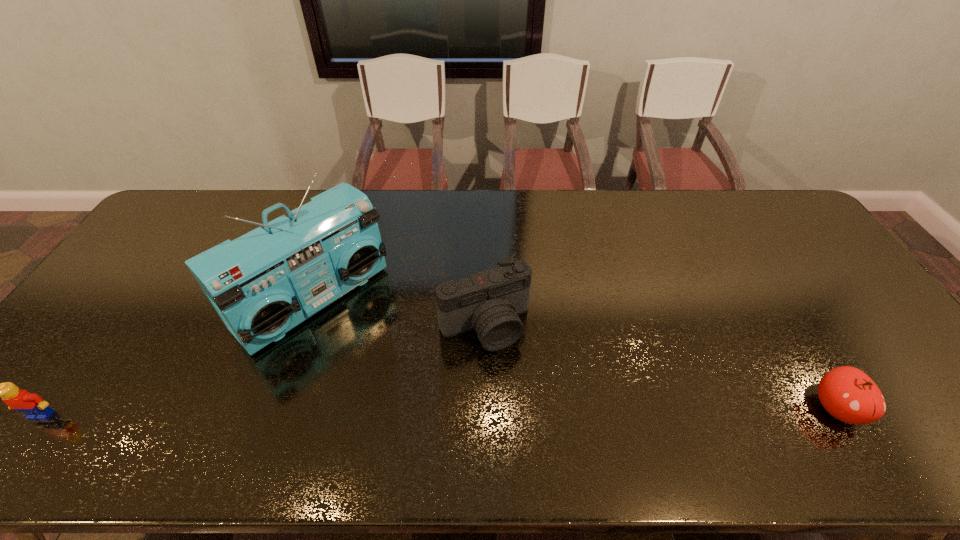
This screenshot has width=960, height=540. In the image, there is a desktop. In order to click on vacant area at the right edge in this screenshot , I will do `click(790, 240)`.

In the image, there is a desktop. At what (x,y) coordinates should I click in order to perform the action: click on vacant space at the far right corner. Please return your answer as a coordinate pair (x, y). The height and width of the screenshot is (540, 960). Looking at the image, I should click on (773, 199).

The width and height of the screenshot is (960, 540). Identify the location of vacant area that lies between the leftmost object and the camera. (263, 370).

You are a GUI agent. You are given a task and a screenshot of the screen. Output one action in this format:
    pyautogui.click(x=<x>, y=<y>)
    Task: Click on the unoccupied area between the leftmost object and the camera
    
    Given the screenshot: What is the action you would take?
    pyautogui.click(x=263, y=370)

Find the location of `vacant area that lies between the Lego and the rightmost object`. vacant area that lies between the Lego and the rightmost object is located at coordinates (440, 411).

The height and width of the screenshot is (540, 960). I want to click on free space between the third object from right to left and the second tallest object, so click(x=399, y=313).

Find the location of `unoccupied position between the camera and the apple`. unoccupied position between the camera and the apple is located at coordinates (660, 367).

Where is `vacant area that lies between the apple and the third shortest object`? The image size is (960, 540). vacant area that lies between the apple and the third shortest object is located at coordinates pyautogui.click(x=660, y=367).

Image resolution: width=960 pixels, height=540 pixels. Identify the location of free spot between the rightmost object and the Lego. (x=440, y=411).

Identify the location of vacant space in between the Lego and the camera. The height and width of the screenshot is (540, 960). pyautogui.click(x=263, y=370).